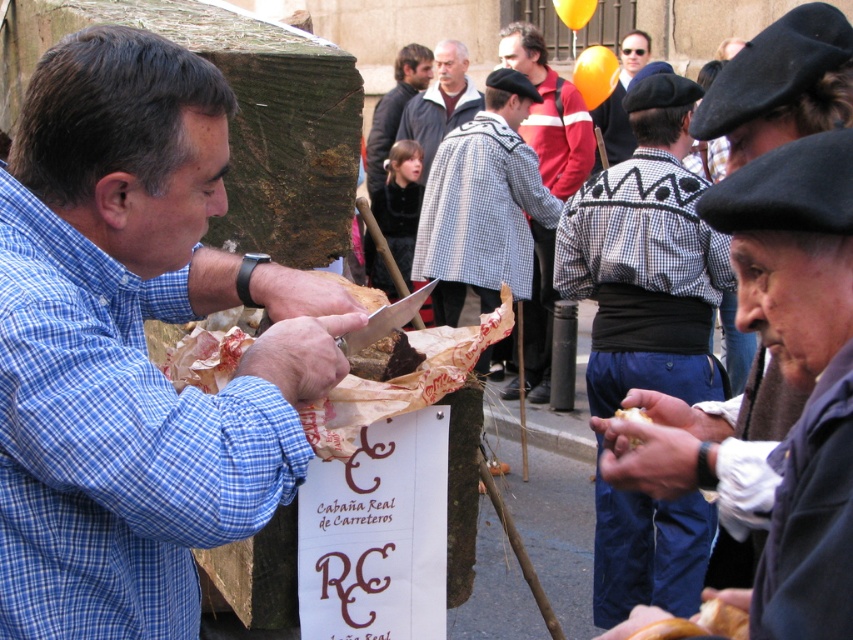
Is checkered wool coat at center smaller than gray wool coat at center?

No.

Is checkered wool coat at center to the left of gray wool coat at center from the viewer's perspective?

Incorrect, checkered wool coat at center is not on the left side of gray wool coat at center.

Find the location of a particular element. This screenshot has height=640, width=853. checkered wool coat at center is located at coordinates pyautogui.click(x=483, y=204).

Between point (82, 88) and point (186, 378), which one is positioned in front?

Point (82, 88) is more forward.

Is blue plaid shirt at left shorter than shiny brown paper at center?

No, blue plaid shirt at left is not shorter than shiny brown paper at center.

The image size is (853, 640). What do you see at coordinates (135, 346) in the screenshot?
I see `blue plaid shirt at left` at bounding box center [135, 346].

Identify the location of blue plaid shirt at left. This screenshot has width=853, height=640. (135, 346).

Can you confirm if gray wool coat at center is shorter than smooth gray jacket at center?

Yes, gray wool coat at center is shorter than smooth gray jacket at center.

Is point (442, 76) closer to viewer compared to point (380, 173)?

No, (442, 76) is further to viewer.

Is point (473, 88) positioned before point (370, 179)?

No, it is not.

At what (x,y) coordinates should I click in order to perform the action: click on gray wool coat at center. Please return your answer as a coordinate pair (x, y). Image resolution: width=853 pixels, height=640 pixels. Looking at the image, I should click on pyautogui.click(x=440, y=102).